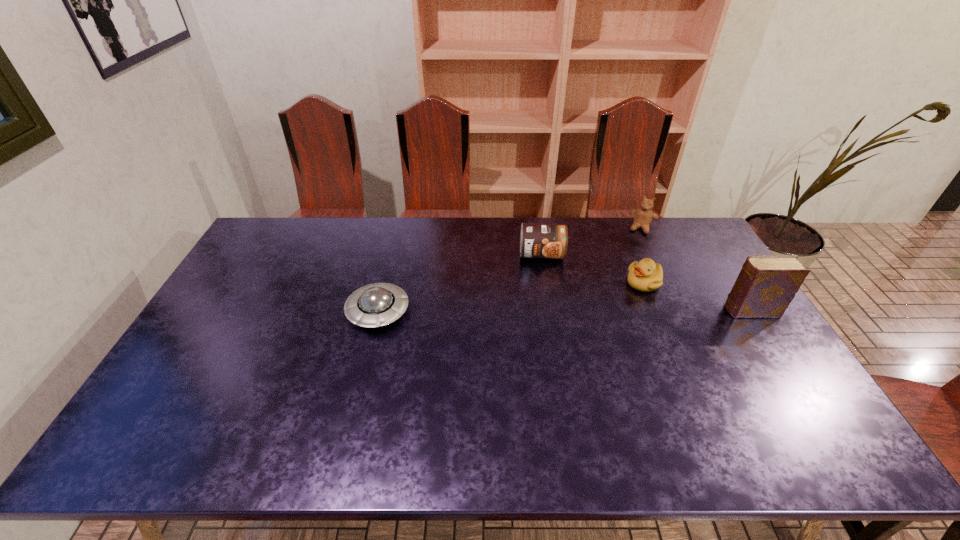
Image resolution: width=960 pixels, height=540 pixels. I want to click on free space located 0.270m on the face of the teddy bear, so click(x=628, y=278).

You are a GUI agent. You are given a task and a screenshot of the screen. Output one action in this format:
    pyautogui.click(x=<x>, y=<y>)
    Task: Click on the can located in the far edge section of the desktop
    
    Given the screenshot: What is the action you would take?
    pyautogui.click(x=537, y=240)

Identify the location of teddy bear at the far edge. This screenshot has width=960, height=540. (643, 216).

Locate an element on the screen. This screenshot has height=540, width=960. diary located in the right edge section of the desktop is located at coordinates (766, 285).

This screenshot has width=960, height=540. I want to click on teddy bear that is at the right edge, so click(x=643, y=216).

Find the location of `object that is positioned at the far right corner`. object that is positioned at the far right corner is located at coordinates (643, 216).

Where is `vacant space at the far edge`? This screenshot has height=540, width=960. vacant space at the far edge is located at coordinates (297, 253).

Where is `vacant space at the near edge of the desktop`? The height and width of the screenshot is (540, 960). vacant space at the near edge of the desktop is located at coordinates (287, 391).

Identify the location of vacant space at the left edge. The height and width of the screenshot is (540, 960). (235, 270).

You are a GUI agent. You are given a task and a screenshot of the screen. Output one action in this format:
    pyautogui.click(x=<x>, y=<y>)
    Task: Click on the vacant space at the right edge of the desktop
    The height and width of the screenshot is (540, 960).
    Given the screenshot: What is the action you would take?
    pyautogui.click(x=755, y=352)